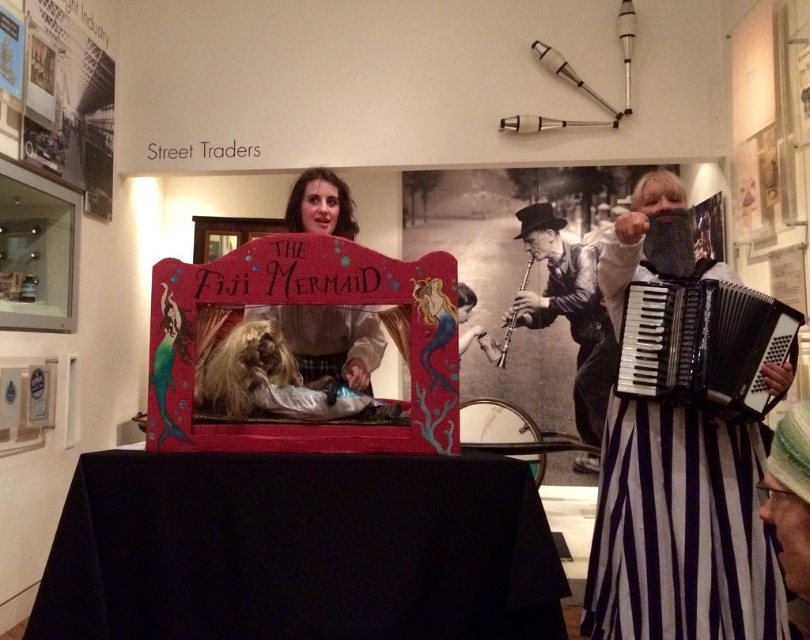
You are a museum visitor holding a small backpack. You want to place both the black plastic accordion at right and the silver metallic flute at center into your backpack. Which one should you put in first to ensure both fit?

You should put the black plastic accordion at right first since it is bigger than the silver metallic flute at center, allowing more space for the smaller item afterward.

You are an art curator standing at the entrance of the museum exhibit. You need to determine the spatial relationship between two points marked on the floor plan. Are the two points, point (759,353) and point (519,284), aligned in a way that one is in front of the other from your current viewpoint?

Yes, point (759,353) is in front of point (519,284) from your viewpoint.

You are a visitor at the museum and notice the black striped dress at right and the silver metallic flute at center. Which object is positioned lower in the image?

The black striped dress at right is located below the silver metallic flute at center, so it is positioned lower in the image.